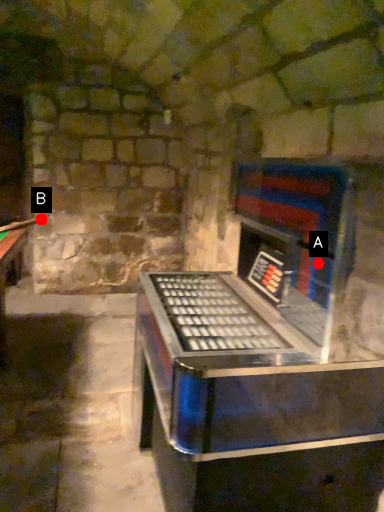
Question: Two points are circled on the image, labeled by A and B beside each circle. Which of the following is the closest to the observer?

Choices:
 (A) A is closer
 (B) B is closer

Answer: (A)